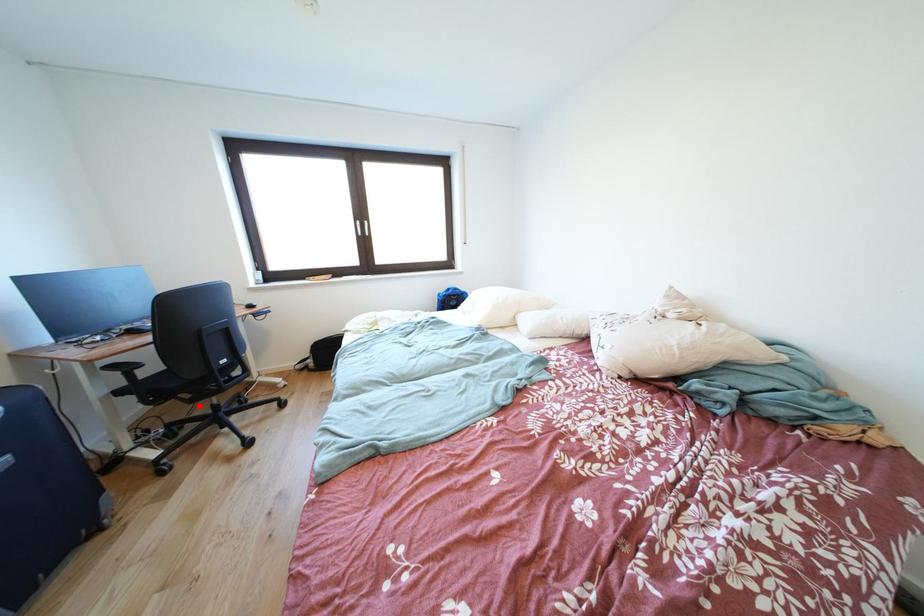
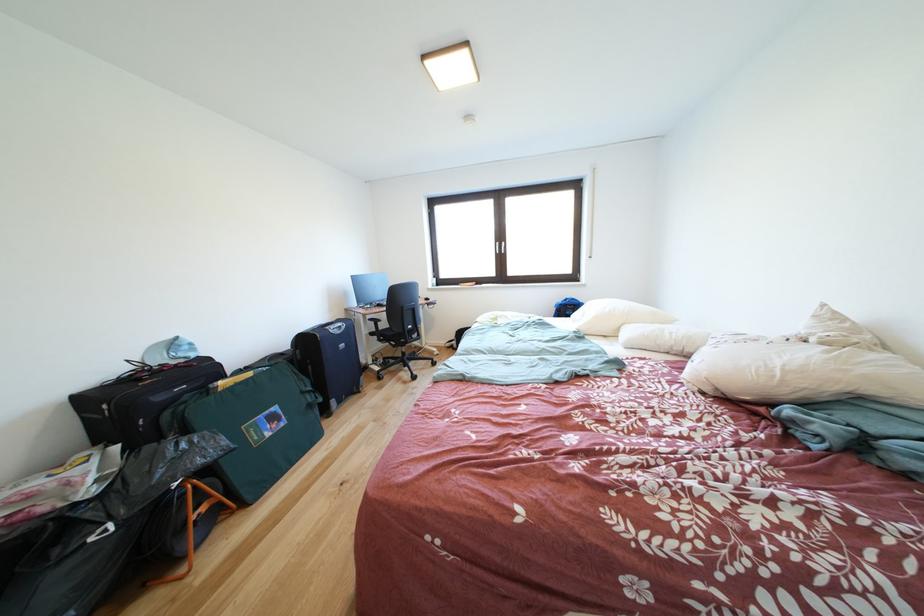
Question: I am providing you with two images of the same scene from different viewpoints. A red point is marked on the first image. Can you still see the location of the red point in image 2?

Choices:
 (A) Yes
 (B) No

Answer: (A)